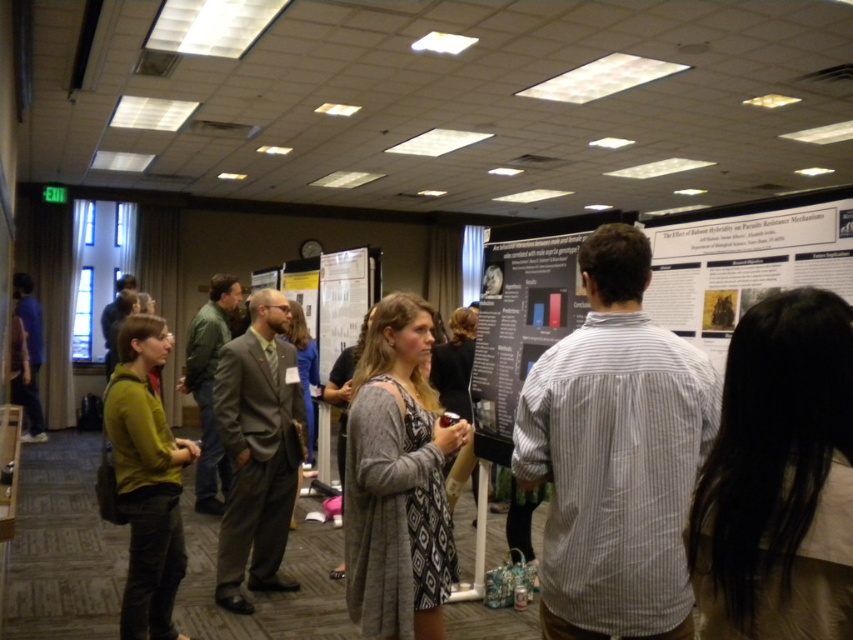
Which is behind, point (223, 369) or point (122, 433)?

The point (223, 369) is more distant.

Locate an element on the screen. Image resolution: width=853 pixels, height=640 pixels. gray suit at center is located at coordinates (258, 451).

Between black hair at upper right and gray textured dress at center, which one has more height?

Standing taller between the two is gray textured dress at center.

Does black hair at upper right appear over gray textured dress at center?

Correct, black hair at upper right is located above gray textured dress at center.

Where is `black hair at upper right`? Image resolution: width=853 pixels, height=640 pixels. black hair at upper right is located at coordinates [779, 477].

Locate an element on the screen. This screenshot has height=640, width=853. black hair at upper right is located at coordinates (779, 477).

Is point (502, 276) in front of point (213, 376)?

Yes, point (502, 276) is in front of point (213, 376).

Can you confirm if dark gray poster at center is positioned to the right of gray suit at center?

Indeed, dark gray poster at center is positioned on the right side of gray suit at center.

Identify the location of dark gray poster at center. (647, 285).

Image resolution: width=853 pixels, height=640 pixels. What are the coordinates of `dark gray poster at center` in the screenshot? It's located at pos(647,285).